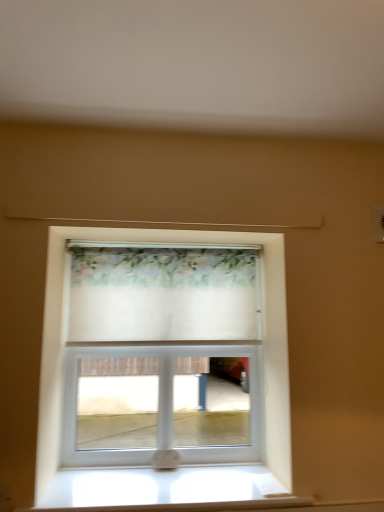
At what (x,y) coordinates should I click in order to perform the action: click on vacant point above white wood window sill at lower center (from a real-world perspective). Please return your answer as a coordinate pair (x, y). Looking at the image, I should click on (173, 484).